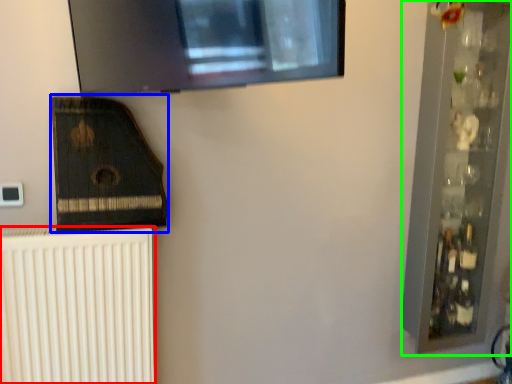
Question: Considering the real-world distances, which object is farthest from radiator (highlighted by a red box)? amplifier (highlighted by a blue box) or shelf (highlighted by a green box)?

Choices:
 (A) amplifier
 (B) shelf

Answer: (B)